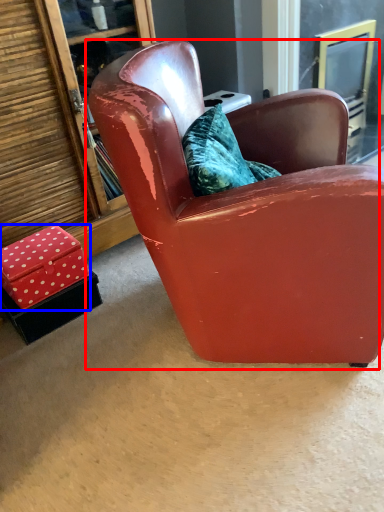
Question: Which point is further to the camera, chair (highlighted by a red box) or box (highlighted by a blue box)?

Choices:
 (A) chair
 (B) box

Answer: (B)